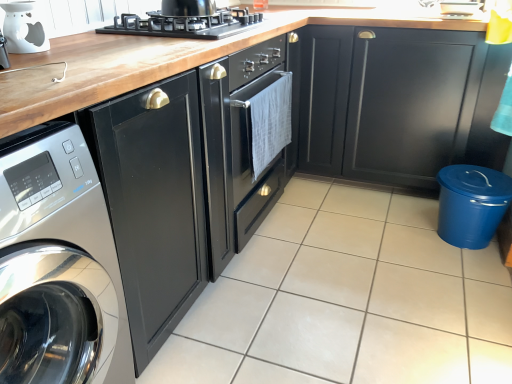
Question: Is black matte gas stove at upper center bigger or smaller than white glossy oil burner at upper left, arranged as the first appliance when viewed from the front?

Choices:
 (A) small
 (B) big

Answer: (B)

Question: In the image, is black matte gas stove at upper center positioned in front of or behind white glossy oil burner at upper left, the 1th appliance positioned from the left?

Choices:
 (A) front
 (B) behind

Answer: (B)

Question: Which object is the farthest from the satin silver washing machine at left?

Choices:
 (A) glossy black cabinet at center, placed as the first cabinetry when sorted from left to right
 (B) white glossy oil burner at upper left, the 1th appliance positioned from the left
 (C) white glossy tile at center
 (D) black matte gas stove at upper center
 (E) matte black cabinet at lower right, the 1th cabinetry viewed from the right

Answer: (E)

Question: Considering the real-world distances, which object is closest to the glossy black cabinet at center, marked as the 2th cabinetry in a right-to-left arrangement?

Choices:
 (A) satin silver washing machine at left
 (B) white glossy tile at center
 (C) matte black cabinet at lower right, which is the second cabinetry from left to right
 (D) black matte gas stove at upper center
 (E) blue plastic trash can at lower right, which is counted as the 2th appliance, starting from the front

Answer: (A)